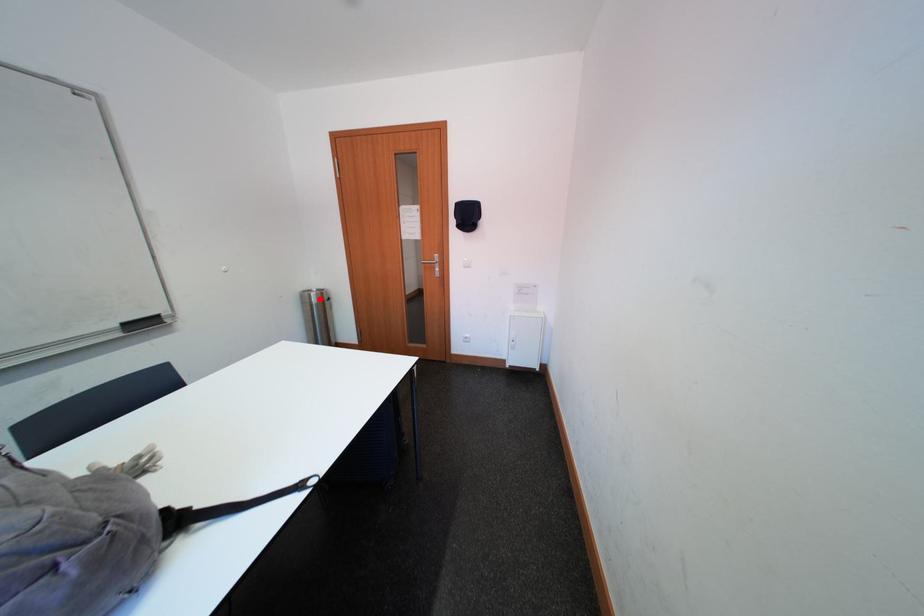
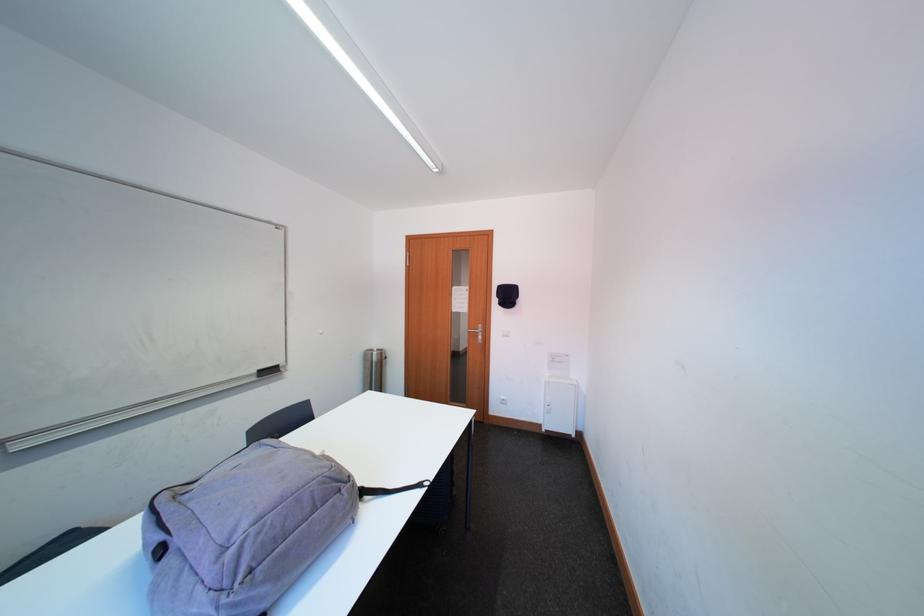
Question: I am providing you with two images of the same scene from different viewpoints. Given a red point in image1, look at the same physical point in image2. Is it:

Choices:
 (A) Closer to the viewpoint
 (B) Farther from the viewpoint

Answer: (B)